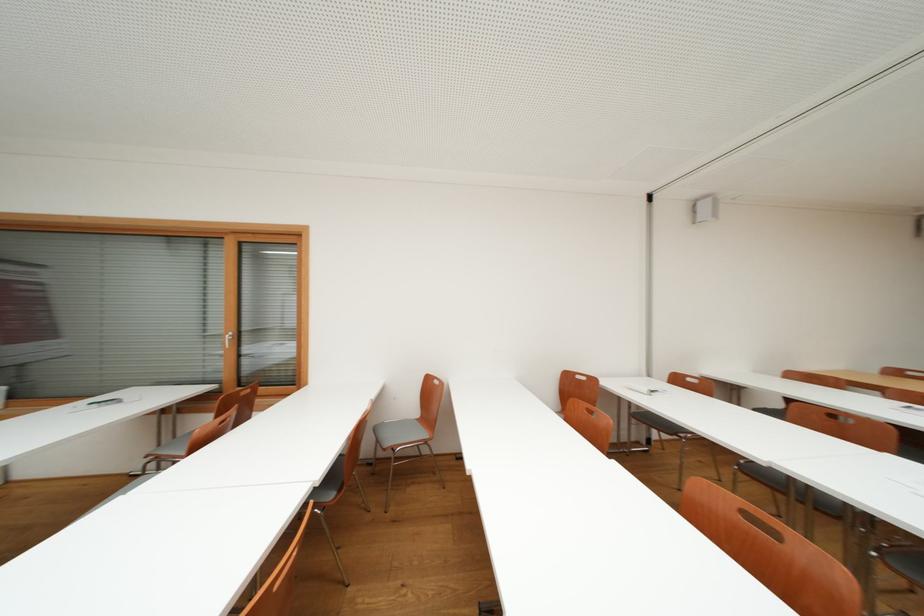
Identify the location of closed white laptop. This screenshot has height=616, width=924. (642, 387).